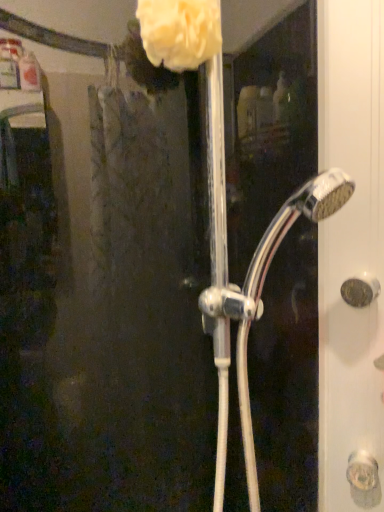
Question: Is white fluffy sponge at upper center shorter than chrome metallic showerhead at center?

Choices:
 (A) yes
 (B) no

Answer: (A)

Question: Can you confirm if white fluffy sponge at upper center is thinner than chrome metallic showerhead at center?

Choices:
 (A) no
 (B) yes

Answer: (B)

Question: Is white fluffy sponge at upper center at the left side of chrome metallic showerhead at center?

Choices:
 (A) yes
 (B) no

Answer: (A)

Question: Is white fluffy sponge at upper center in front of chrome metallic showerhead at center?

Choices:
 (A) no
 (B) yes

Answer: (A)

Question: Is white fluffy sponge at upper center facing towards chrome metallic showerhead at center?

Choices:
 (A) yes
 (B) no

Answer: (B)

Question: Relative to chrome metallic showerhead at center, is white fluffy sponge at upper center in front or behind?

Choices:
 (A) behind
 (B) front

Answer: (A)

Question: Is white fluffy sponge at upper center spatially inside chrome metallic showerhead at center, or outside of it?

Choices:
 (A) inside
 (B) outside

Answer: (A)

Question: From the image's perspective, is white fluffy sponge at upper center positioned above or below chrome metallic showerhead at center?

Choices:
 (A) above
 (B) below

Answer: (A)

Question: From a real-world perspective, is white fluffy sponge at upper center above or below chrome metallic showerhead at center?

Choices:
 (A) below
 (B) above

Answer: (B)

Question: From the image's perspective, is matte gold door handle at right located above or below chrome metallic showerhead at center?

Choices:
 (A) above
 (B) below

Answer: (B)

Question: From a real-world perspective, is matte gold door handle at right above or below chrome metallic showerhead at center?

Choices:
 (A) below
 (B) above

Answer: (A)

Question: Considering their positions, is matte gold door handle at right located in front of or behind chrome metallic showerhead at center?

Choices:
 (A) front
 (B) behind

Answer: (B)

Question: Is matte gold door handle at right taller or shorter than chrome metallic showerhead at center?

Choices:
 (A) tall
 (B) short

Answer: (B)

Question: In terms of height, does white fluffy sponge at upper center look taller or shorter compared to matte gold door handle at right?

Choices:
 (A) short
 (B) tall

Answer: (B)

Question: From the image's perspective, is white fluffy sponge at upper center positioned above or below matte gold door handle at right?

Choices:
 (A) below
 (B) above

Answer: (B)